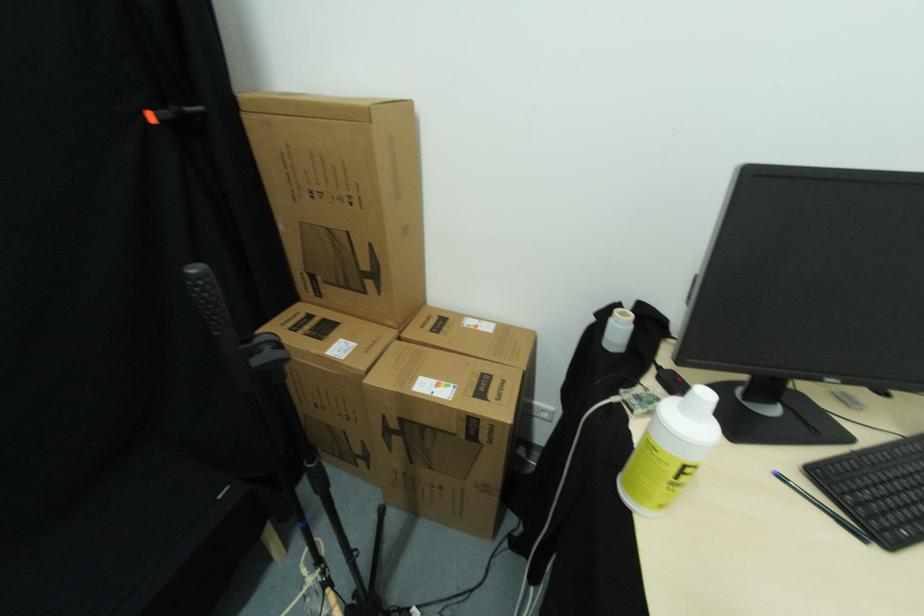
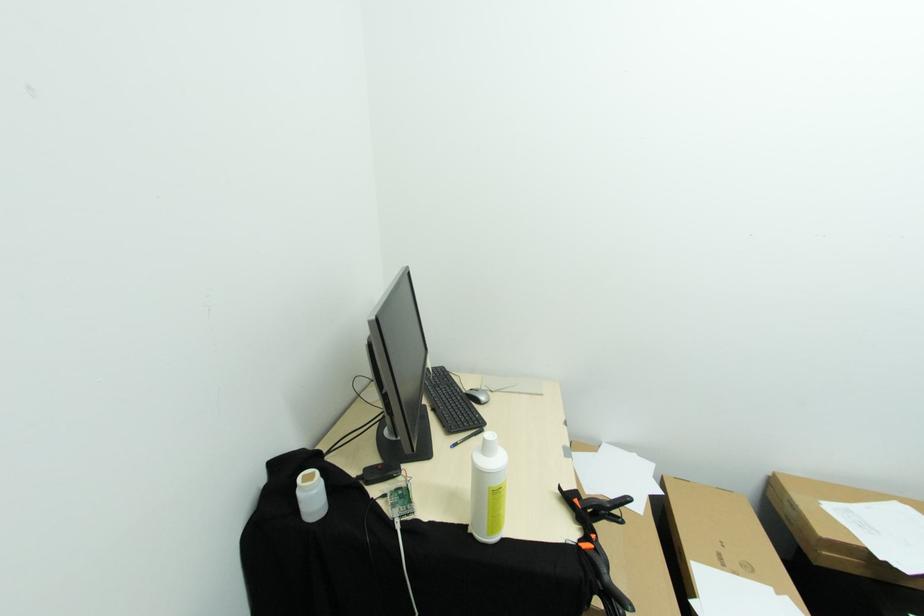
Question: I am providing you with two images of the same scene from different viewpoints. Which of the following objects are not visible in image2?

Choices:
 (A) computer mouse
 (B) black clamp handle
 (C) keyboard keys
 (D) none of these

Answer: (D)